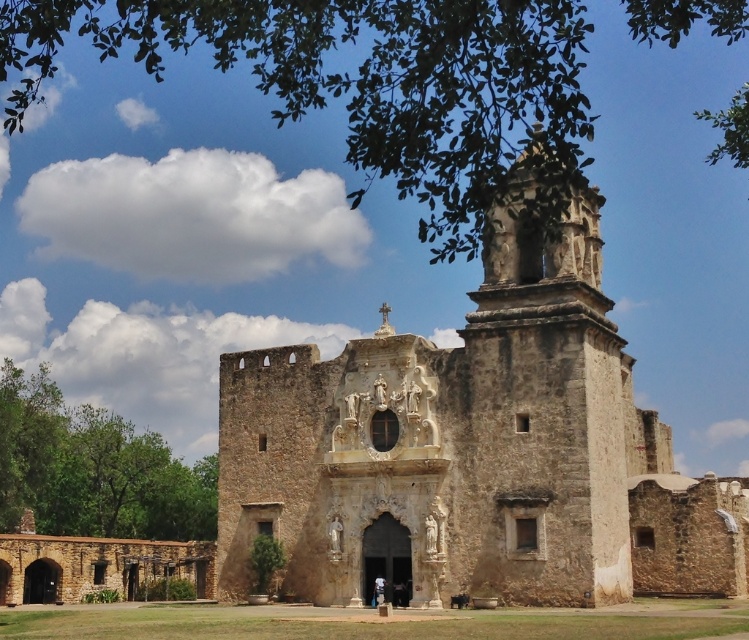
Based on the photo, you are standing in front of the historic stone church and notice two green leafy trees in the scene. Which tree, the green leafy tree at upper center or the green leafy tree at lower left, is closer to you?

The green leafy tree at upper center is closer to you because it is in front of the green leafy tree at lower left.

You are standing in front of the historic stone church and notice a green leafy tree at lower left and a white cotton shirt at center. From your perspective, which object is positioned higher up?

A: The green leafy tree at lower left is located above the white cotton shirt at center, so it is positioned higher up.

You are standing in front of the historic stone church and notice the green leafy tree at lower left and the white cotton shirt at center. Which object is closer to you?

The green leafy tree at lower left is closer to you because the white cotton shirt at center is behind it.